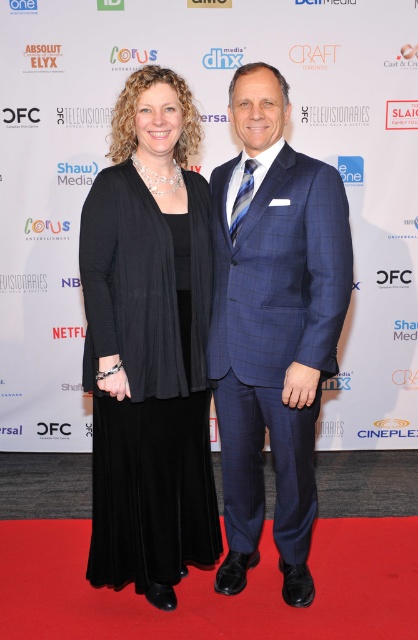
You are a photographer at the event and need to ensure the black matte dress at center is visible in the photo. Based on its position coordinates, where should you focus the camera lens?

The black matte dress at center is located at coordinates point (148, 346), so the photographer should focus the camera lens at that point to ensure visibility.

You are a photographer at the event and need to ensure both the black matte dress at center and the blue checkered suit at center are visible in your photo. Given their sizes, which one might you need to position closer to the camera to ensure both are clearly visible?

The black matte dress at center is smaller in size compared to the blue checkered suit at center. To ensure both are clearly visible, position the black matte dress at center closer to the camera since its smaller size may require closer framing to capture details.